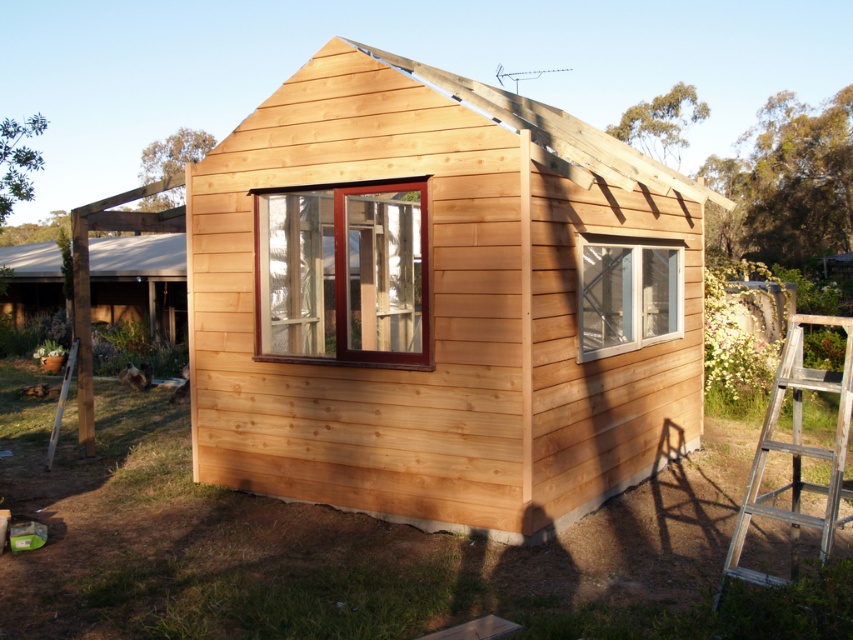
How distant is brown wooden window at center from silver metallic ladder at left?

brown wooden window at center is 4.45 meters away from silver metallic ladder at left.

Which of these two, brown wooden window at center or silver metallic ladder at left, stands shorter?

Standing shorter between the two is silver metallic ladder at left.

Describe the element at coordinates (344, 273) in the screenshot. I see `brown wooden window at center` at that location.

Locate an element on the screen. The image size is (853, 640). brown wooden window at center is located at coordinates (344, 273).

Consider the image. Can you confirm if silver metallic ladder at lower right is thinner than clear glass window at center?

Yes, silver metallic ladder at lower right is thinner than clear glass window at center.

Consider the image. Is silver metallic ladder at lower right shorter than clear glass window at center?

No.

Is point (746, 516) positioned in front of point (680, 316)?

Yes, point (746, 516) is closer to viewer.

Identify the location of silver metallic ladder at lower right. coord(798,452).

Is natural wood cabin at center above clear glass window at center?

Actually, natural wood cabin at center is below clear glass window at center.

Is natural wood cabin at center taller than clear glass window at center?

Correct, natural wood cabin at center is much taller as clear glass window at center.

Is point (260, 284) in front of point (605, 342)?

Yes, point (260, 284) is in front of point (605, 342).

At what (x,y) coordinates should I click in order to perform the action: click on natural wood cabin at center. Please return your answer as a coordinate pair (x, y). Image resolution: width=853 pixels, height=640 pixels. Looking at the image, I should click on (438, 301).